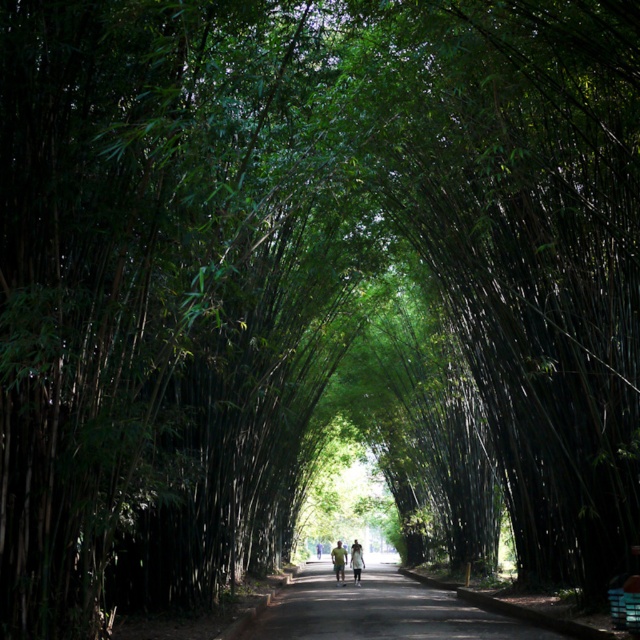
Can you confirm if light brown leather jacket at center is thinner than light green fabric at center?

Yes, light brown leather jacket at center is thinner than light green fabric at center.

Between light brown leather jacket at center and light green fabric at center, which one appears on the right side from the viewer's perspective?

Positioned to the right is light green fabric at center.

Who is more forward, (346, 557) or (360, 545)?

Point (346, 557) is in front.

Where is `light brown leather jacket at center`? This screenshot has width=640, height=640. light brown leather jacket at center is located at coordinates (339, 561).